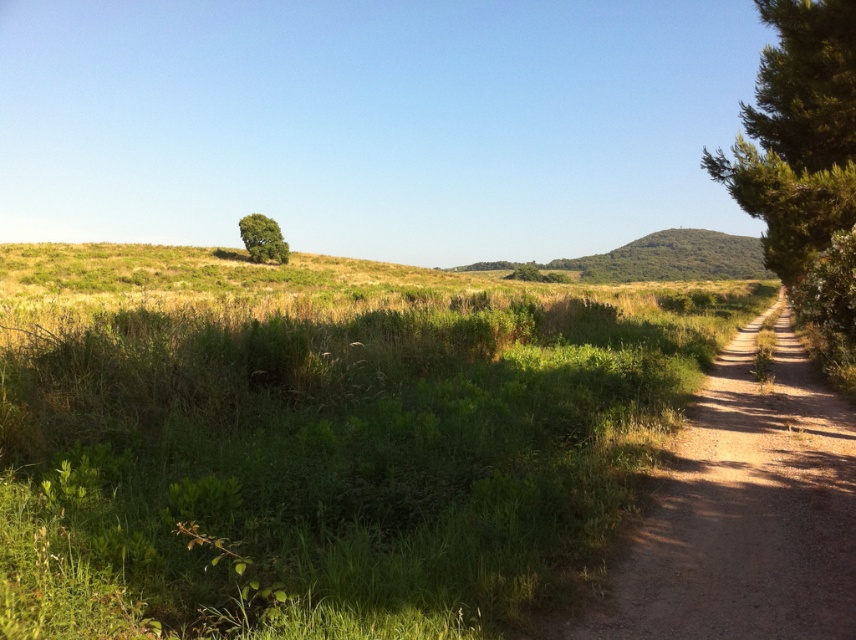
You are a photographer standing at the starting point of the dirt path in the rural landscape. You want to take a photo that includes both the point at coordinates point (694, 452) and point (253, 218). Which point should you focus on to ensure both are in sharp focus?

You should focus on point (253, 218) because it is farther from the camera than point (694, 452). By focusing on the farther point, the closer point will also be within the depth of field, ensuring both are in sharp focus.

You are a landscape photographer planning to capture a wide shot of the scene. You want to ensure both the green leafy tree at right and the green leafy tree at upper left are visible in your frame. Given their sizes, which tree should you position closer to the center of the photo to emphasize its prominence?

The green leafy tree at right is larger in width than the green leafy tree at upper left. To emphasize its prominence, you should position the green leafy tree at right closer to the center of the photo.